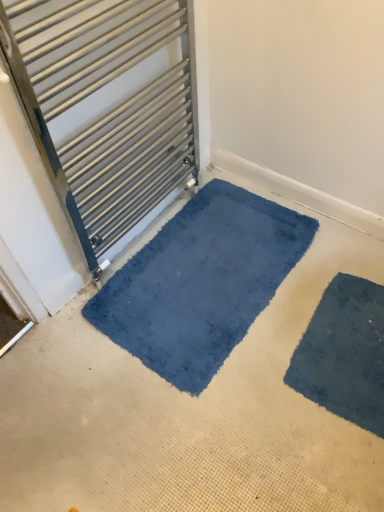
Identify the location of vacant space underneath dark blue plush bath mat at lower right (from a real-world perspective). (331, 356).